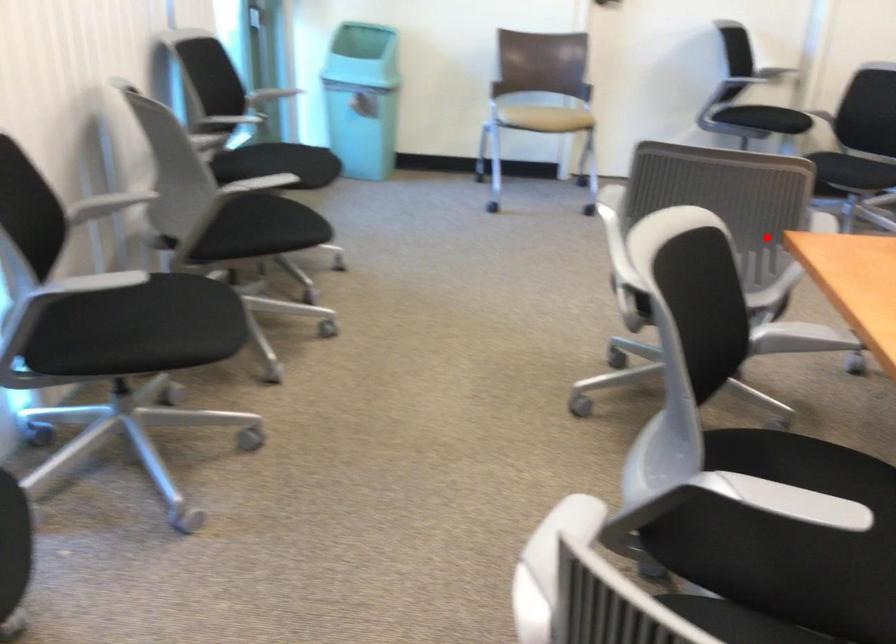
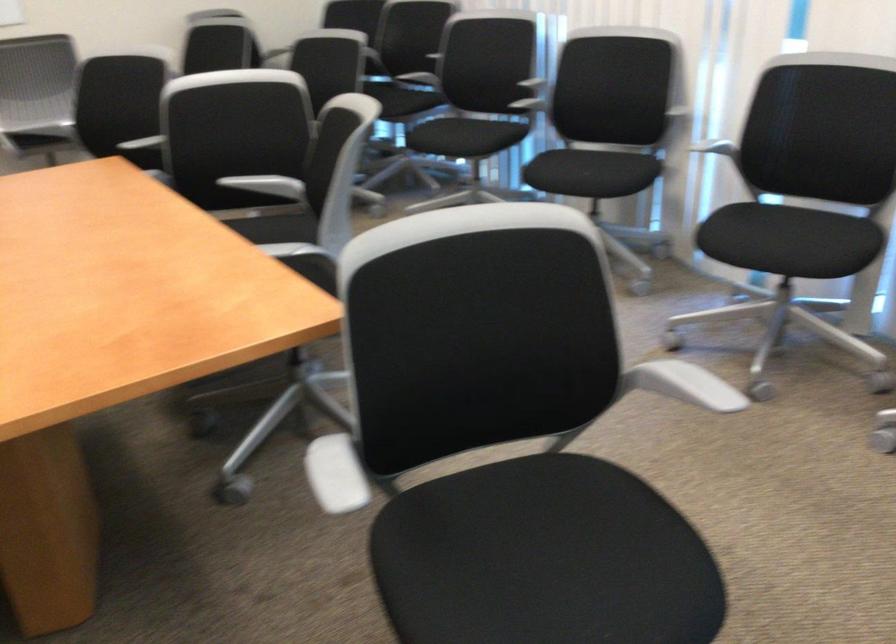
Question: I am providing you with two images of the same scene from different viewpoints. A red point is shown in image1. For the corresponding object point in image2, is it positioned nearer or farther from the camera?

Choices:
 (A) Nearer
 (B) Farther

Answer: (A)